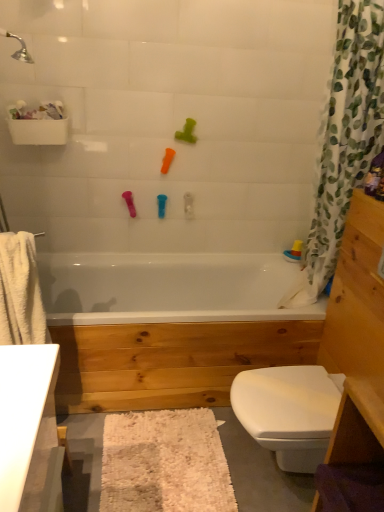
Question: Is translucent plastic boat at upper right, which ranks as the first toy in right-to-left order, smaller than light brown wood vanity at right?

Choices:
 (A) no
 (B) yes

Answer: (B)

Question: Is translucent plastic boat at upper right, positioned as the fifth toy in top-to-bottom order, bigger than light brown wood vanity at right?

Choices:
 (A) yes
 (B) no

Answer: (B)

Question: Does translucent plastic boat at upper right, which appears as the 5th toy when viewed from the left, lie behind light brown wood vanity at right?

Choices:
 (A) yes
 (B) no

Answer: (A)

Question: Does translucent plastic boat at upper right, positioned as the fifth toy in top-to-bottom order, have a greater width compared to light brown wood vanity at right?

Choices:
 (A) yes
 (B) no

Answer: (B)

Question: From the image's perspective, is translucent plastic boat at upper right, positioned as the fifth toy in top-to-bottom order, below light brown wood vanity at right?

Choices:
 (A) no
 (B) yes

Answer: (A)

Question: In the image, is orange rubber toy at upper center, which is the third toy from left to right, positioned in front of or behind green rubber toy at upper center, marked as the fourth toy in a left-to-right arrangement?

Choices:
 (A) behind
 (B) front

Answer: (A)

Question: Is orange rubber toy at upper center, which is the third toy from left to right, situated inside green rubber toy at upper center, the 5th toy ordered from the bottom, or outside?

Choices:
 (A) outside
 (B) inside

Answer: (A)

Question: From the image's perspective, is orange rubber toy at upper center, arranged as the 4th toy when ordered from the bottom, above or below green rubber toy at upper center, the 5th toy ordered from the bottom?

Choices:
 (A) above
 (B) below

Answer: (B)

Question: Considering the positions of orange rubber toy at upper center, the 3th toy positioned from the right, and green rubber toy at upper center, marked as the second toy in a right-to-left arrangement, in the image, is orange rubber toy at upper center, the 3th toy positioned from the right, bigger or smaller than green rubber toy at upper center, marked as the second toy in a right-to-left arrangement,?

Choices:
 (A) big
 (B) small

Answer: (B)

Question: Relative to white fabric shower curtain at right, is white shaggy bath mat at lower center in front or behind?

Choices:
 (A) behind
 (B) front

Answer: (A)

Question: From the image's perspective, relative to white fabric shower curtain at right, is white shaggy bath mat at lower center above or below?

Choices:
 (A) above
 (B) below

Answer: (B)

Question: In terms of height, does white shaggy bath mat at lower center look taller or shorter compared to white fabric shower curtain at right?

Choices:
 (A) short
 (B) tall

Answer: (A)

Question: In terms of width, does white shaggy bath mat at lower center look wider or thinner when compared to white fabric shower curtain at right?

Choices:
 (A) thin
 (B) wide

Answer: (B)

Question: From a real-world perspective, relative to white fabric shower curtain at right, is translucent plastic boat at upper right, positioned as the fifth toy in top-to-bottom order, vertically above or below?

Choices:
 (A) above
 (B) below

Answer: (B)

Question: Is translucent plastic boat at upper right, which appears as the 5th toy when viewed from the left, wider or thinner than white fabric shower curtain at right?

Choices:
 (A) thin
 (B) wide

Answer: (A)